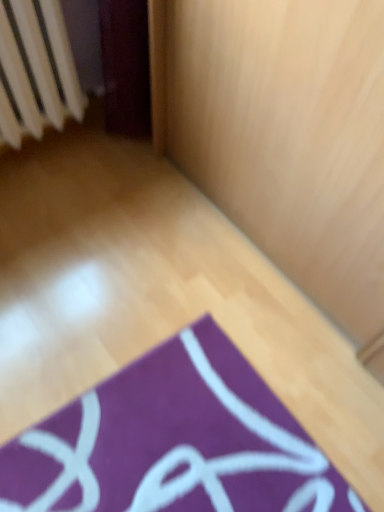
Question: From the image's perspective, is white plastic radiator at upper left located above or below purple fabric yoga mat at lower center?

Choices:
 (A) below
 (B) above

Answer: (B)

Question: Considering the positions of point (8, 98) and point (39, 509), is point (8, 98) closer or farther from the camera than point (39, 509)?

Choices:
 (A) farther
 (B) closer

Answer: (A)

Question: Considering the positions of white plastic radiator at upper left and purple fabric yoga mat at lower center in the image, is white plastic radiator at upper left bigger or smaller than purple fabric yoga mat at lower center?

Choices:
 (A) small
 (B) big

Answer: (B)

Question: Looking at their shapes, would you say purple fabric yoga mat at lower center is wider or thinner than white plastic radiator at upper left?

Choices:
 (A) wide
 (B) thin

Answer: (A)

Question: Is point (334, 471) positioned closer to the camera than point (31, 10)?

Choices:
 (A) farther
 (B) closer

Answer: (B)

Question: Looking at the image, does purple fabric yoga mat at lower center seem bigger or smaller compared to white plastic radiator at upper left?

Choices:
 (A) big
 (B) small

Answer: (B)

Question: From a real-world perspective, relative to white plastic radiator at upper left, is purple fabric yoga mat at lower center vertically above or below?

Choices:
 (A) above
 (B) below

Answer: (B)